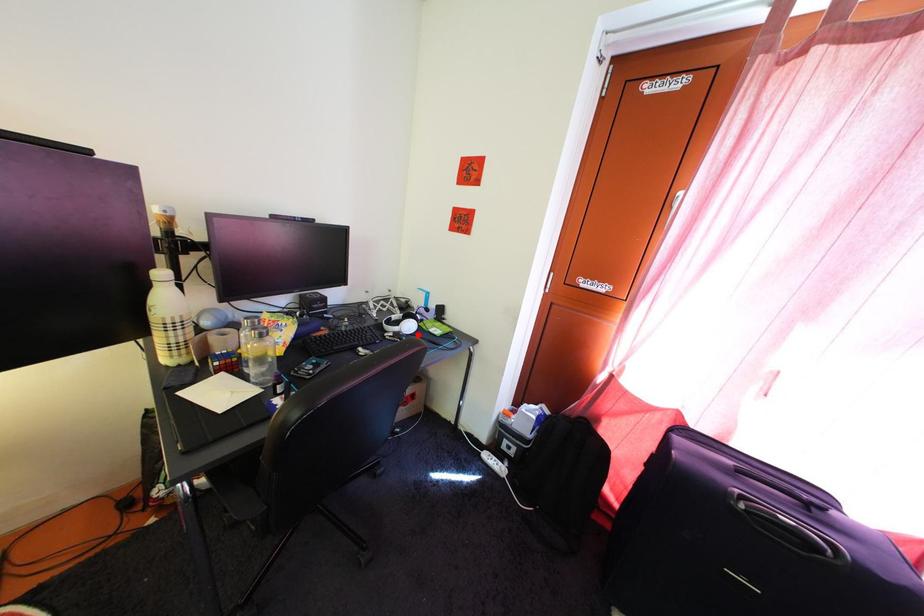
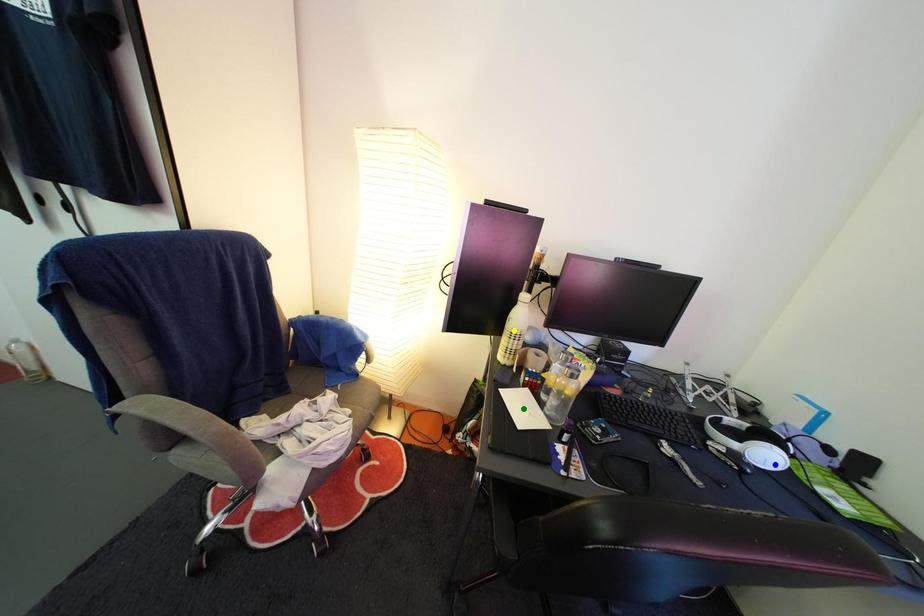
Question: I am providing you with two images of the same scene from different viewpoints. A red point is marked on the first image. You are given multiple points on the second image. Which spot in image 2 lines up with the point in image 1?

Choices:
 (A) yellow point
 (B) green point
 (C) blue point

Answer: (C)